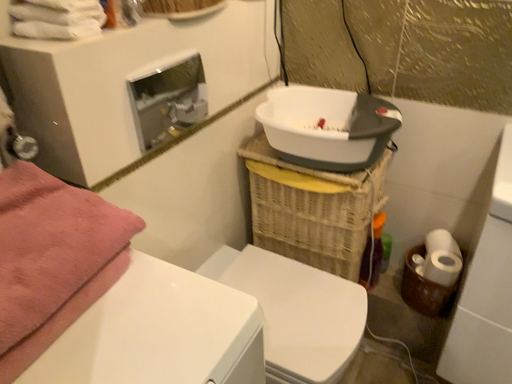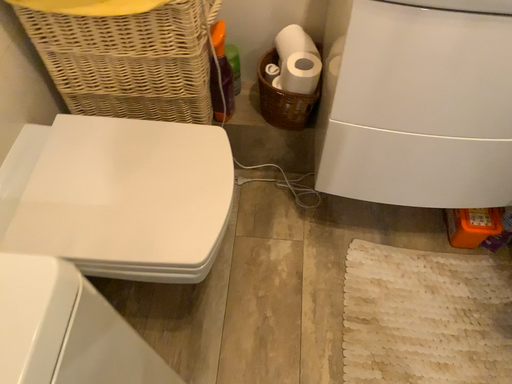
Question: Which way did the camera rotate in the video?

Choices:
 (A) rotated left
 (B) rotated right

Answer: (B)